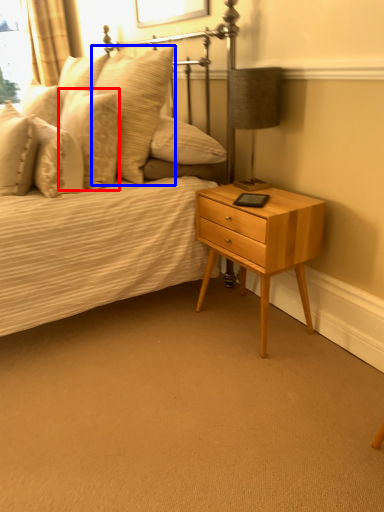
Question: Which of the following is the farthest to the observer, pillow (highlighted by a red box) or pillow (highlighted by a blue box)?

Choices:
 (A) pillow
 (B) pillow

Answer: (A)